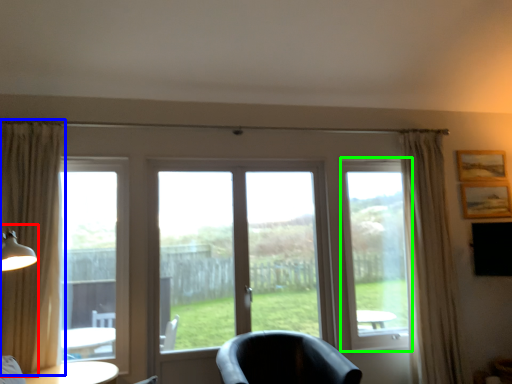
Question: Which object is the farthest from table lamp (highlighted by a red box)? Choose among these: curtain (highlighted by a blue box) or window screen (highlighted by a green box).

Choices:
 (A) curtain
 (B) window screen

Answer: (B)